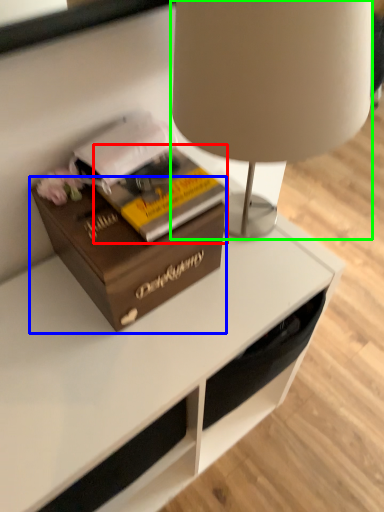
Question: Based on their relative distances, which object is farther from paperback book (highlighted by a red box)? Choose from box (highlighted by a blue box) and lamp (highlighted by a green box).

Choices:
 (A) box
 (B) lamp

Answer: (B)